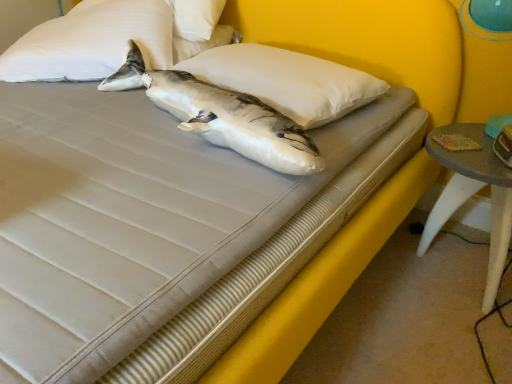
This screenshot has width=512, height=384. Find the location of `yellow fabric bed frame at center`. yellow fabric bed frame at center is located at coordinates (266, 268).

Where is `white matte shark at center`? white matte shark at center is located at coordinates (222, 116).

Looking at the image, does white soft pillow at center, arranged as the 2th pillow when viewed from the left, seem bigger or smaller compared to yellow fabric bed frame at center?

In the image, white soft pillow at center, arranged as the 2th pillow when viewed from the left, appears to be smaller than yellow fabric bed frame at center.

Is white soft pillow at center, positioned as the first pillow in right-to-left order, directly adjacent to yellow fabric bed frame at center?

No, white soft pillow at center, positioned as the first pillow in right-to-left order, is not next to yellow fabric bed frame at center.

Is white soft pillow at center, arranged as the 2th pillow when viewed from the left, taller or shorter than yellow fabric bed frame at center?

white soft pillow at center, arranged as the 2th pillow when viewed from the left, is taller than yellow fabric bed frame at center.

From the image's perspective, which object appears higher, white soft pillow at center, positioned as the first pillow in right-to-left order, or yellow fabric bed frame at center?

white soft pillow at center, positioned as the first pillow in right-to-left order, appears higher in the image.

The width and height of the screenshot is (512, 384). I want to click on pillow to the left of white matte shark at center, so tap(91, 42).

From a real-world perspective, does white matte shark at center sit lower than white soft pillow at upper left, the 1th pillow viewed from the left?

Yes.

Looking at this image, which is in front, white matte shark at center or white soft pillow at upper left, positioned as the 2th pillow in right-to-left order?

white matte shark at center is closer to the camera.

Which object is positioned more to the right, white matte shark at center or white soft pillow at upper left, the 1th pillow viewed from the left?

Positioned to the right is white matte shark at center.

From a real-world perspective, is white soft pillow at upper left, positioned as the 2th pillow in right-to-left order, positioned under white matte shark at center based on gravity?

No, from a real-world perspective, white soft pillow at upper left, positioned as the 2th pillow in right-to-left order, is not under white matte shark at center.

Is white soft pillow at upper left, the 1th pillow viewed from the left, shorter than white matte shark at center?

In fact, white soft pillow at upper left, the 1th pillow viewed from the left, may be taller than white matte shark at center.

Can you confirm if white soft pillow at upper left, positioned as the 2th pillow in right-to-left order, is thinner than white matte shark at center?

No.

Between white soft pillow at upper left, positioned as the 2th pillow in right-to-left order, and white matte shark at center, which one is positioned in front?

white matte shark at center is more forward.

Which of these two, yellow fabric bed frame at center or white soft pillow at upper left, positioned as the 2th pillow in right-to-left order, is smaller?

white soft pillow at upper left, positioned as the 2th pillow in right-to-left order, is smaller.

Is yellow fabric bed frame at center wider than white soft pillow at upper left, the 1th pillow viewed from the left?

Correct, the width of yellow fabric bed frame at center exceeds that of white soft pillow at upper left, the 1th pillow viewed from the left.

Locate an element on the screen. bed frame below the white soft pillow at upper left, positioned as the 2th pillow in right-to-left order (from a real-world perspective) is located at coordinates (266, 268).

In terms of size, does smooth gray table at lower right appear bigger or smaller than white matte shark at center?

In the image, smooth gray table at lower right appears to be larger than white matte shark at center.

Considering the relative positions of smooth gray table at lower right and white matte shark at center in the image provided, is smooth gray table at lower right behind white matte shark at center?

Yes, smooth gray table at lower right is further from the viewer.

From a real-world perspective, who is located higher, smooth gray table at lower right or white matte shark at center?

From a 3D spatial view, white matte shark at center is above.

Which object is thinner, smooth gray table at lower right or white matte shark at center?

Thinner between the two is white matte shark at center.

Is white soft pillow at upper left, positioned as the 2th pillow in right-to-left order, surrounding white soft pillow at center, arranged as the 2th pillow when viewed from the left?

Definitely not — white soft pillow at center, arranged as the 2th pillow when viewed from the left, is not inside white soft pillow at upper left, positioned as the 2th pillow in right-to-left order.

Consider the image. Relative to white soft pillow at center, positioned as the first pillow in right-to-left order, is white soft pillow at upper left, the 1th pillow viewed from the left, in front or behind?

Clearly, white soft pillow at upper left, the 1th pillow viewed from the left, is behind white soft pillow at center, positioned as the first pillow in right-to-left order.

From a real-world perspective, is white soft pillow at upper left, positioned as the 2th pillow in right-to-left order, physically above white soft pillow at center, positioned as the first pillow in right-to-left order?

Indeed, from a real-world perspective, white soft pillow at upper left, positioned as the 2th pillow in right-to-left order, stands above white soft pillow at center, positioned as the first pillow in right-to-left order.

Can you see white soft pillow at upper left, positioned as the 2th pillow in right-to-left order, touching white soft pillow at center, positioned as the first pillow in right-to-left order?

No.

Can you confirm if white matte shark at center is positioned to the right of smooth gray table at lower right?

No, white matte shark at center is not to the right of smooth gray table at lower right.

How many degrees apart are the facing directions of white matte shark at center and smooth gray table at lower right?

Answer: The facing directions of white matte shark at center and smooth gray table at lower right are 1.03 degrees apart.

Between point (257, 110) and point (439, 158), which one is positioned in front?

The point (257, 110) is closer to the camera.

Is white matte shark at center spatially inside smooth gray table at lower right, or outside of it?

white matte shark at center exists outside the volume of smooth gray table at lower right.

Locate an element on the screen. bed frame that is under the white soft pillow at center, arranged as the 2th pillow when viewed from the left (from a real-world perspective) is located at coordinates (266, 268).

Which pillow is the 2nd one when counting from the back of the white matte shark at center? Please provide its 2D coordinates.

[(91, 42)]

When comparing their distances from white soft pillow at upper left, the 1th pillow viewed from the left, does white soft pillow at center, arranged as the 2th pillow when viewed from the left, or smooth gray table at lower right seem further?

The object further to white soft pillow at upper left, the 1th pillow viewed from the left, is smooth gray table at lower right.

Looking at the image, which one is located further to white soft pillow at upper left, positioned as the 2th pillow in right-to-left order, yellow fabric bed frame at center or white soft pillow at center, arranged as the 2th pillow when viewed from the left?

yellow fabric bed frame at center lies further to white soft pillow at upper left, positioned as the 2th pillow in right-to-left order, than the other object.

Based on their spatial positions, is smooth gray table at lower right or white matte shark at center further from yellow fabric bed frame at center?

The object further to yellow fabric bed frame at center is smooth gray table at lower right.

Looking at the image, which one is located further to yellow fabric bed frame at center, white soft pillow at center, positioned as the first pillow in right-to-left order, or white matte shark at center?

white matte shark at center.

Considering their positions, is white soft pillow at upper left, the 1th pillow viewed from the left, positioned closer to yellow fabric bed frame at center than white matte shark at center?

white matte shark at center lies closer to yellow fabric bed frame at center than the other object.

Which object lies nearer to the anchor point smooth gray table at lower right, white soft pillow at upper left, the 1th pillow viewed from the left, or white matte shark at center?

The object closer to smooth gray table at lower right is white matte shark at center.

Based on their spatial positions, is white soft pillow at center, arranged as the 2th pillow when viewed from the left, or yellow fabric bed frame at center closer to white soft pillow at upper left, the 1th pillow viewed from the left?

Based on the image, white soft pillow at center, arranged as the 2th pillow when viewed from the left, appears to be nearer to white soft pillow at upper left, the 1th pillow viewed from the left.

Consider the image. From the image, which object appears to be farther from white soft pillow at center, arranged as the 2th pillow when viewed from the left, yellow fabric bed frame at center or smooth gray table at lower right?

smooth gray table at lower right is positioned further to the anchor white soft pillow at center, arranged as the 2th pillow when viewed from the left.

The width and height of the screenshot is (512, 384). Find the location of `bed frame located between white soft pillow at upper left, positioned as the 2th pillow in right-to-left order, and smooth gray table at lower right in the left-right direction`. bed frame located between white soft pillow at upper left, positioned as the 2th pillow in right-to-left order, and smooth gray table at lower right in the left-right direction is located at coordinates coord(266,268).

Locate an element on the screen. The height and width of the screenshot is (384, 512). shark between white soft pillow at upper left, positioned as the 2th pillow in right-to-left order, and smooth gray table at lower right is located at coordinates (222, 116).

Locate an element on the screen. shark located between yellow fabric bed frame at center and white soft pillow at upper left, the 1th pillow viewed from the left, in the depth direction is located at coordinates (222, 116).

Identify the location of pillow located between white soft pillow at upper left, positioned as the 2th pillow in right-to-left order, and smooth gray table at lower right in the left-right direction. (287, 81).